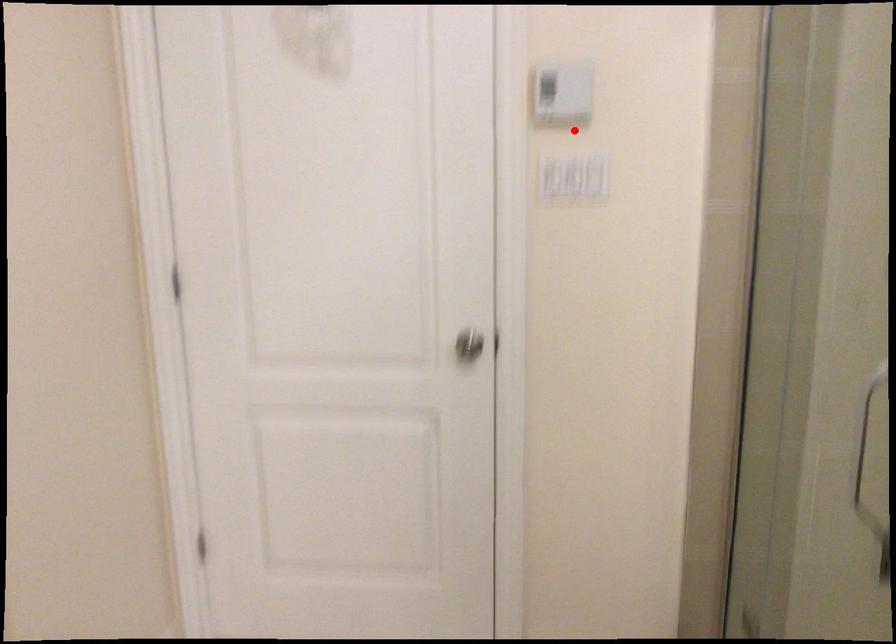
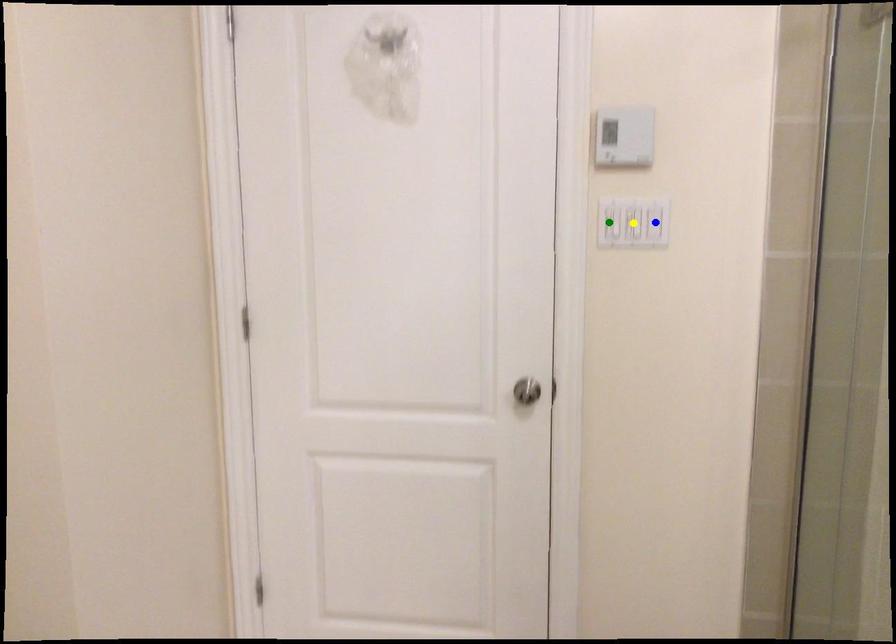
Question: I am providing you with two images of the same scene from different viewpoints. A red point is marked on the first image. You are given multiple points on the second image. Which point in image 2 represents the same 3d spot as the red point in image 1?

Choices:
 (A) blue point
 (B) yellow point
 (C) green point

Answer: (B)